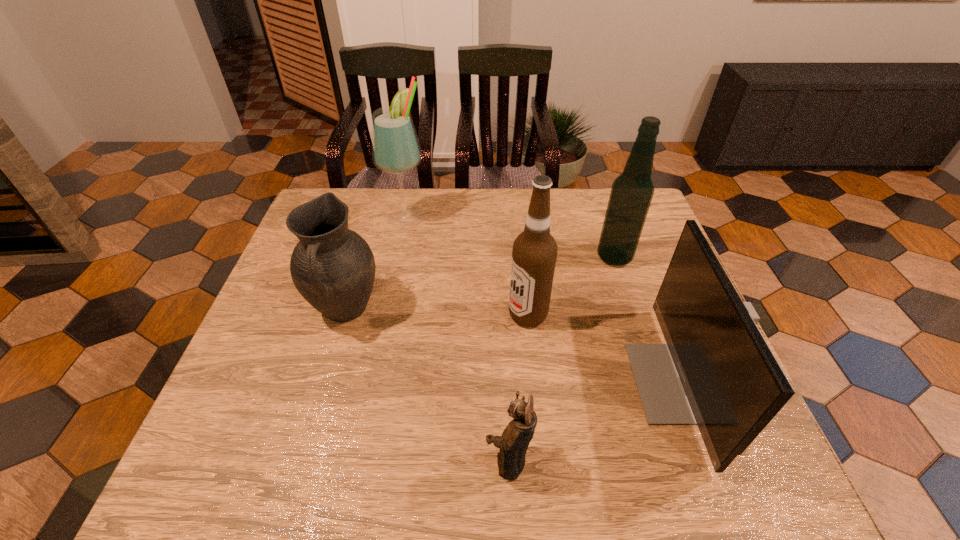
This screenshot has width=960, height=540. I want to click on free space that is in between the computer monitor and the second nearest alcohol, so click(648, 320).

Find the location of `blank region between the nearest alcohol and the computer monitor`. blank region between the nearest alcohol and the computer monitor is located at coordinates (605, 349).

Identify the location of object that is the nearest to the rightmost alcohol. The width and height of the screenshot is (960, 540). (717, 371).

Where is `object that is the fourth nearest to the shortest object`? The width and height of the screenshot is (960, 540). object that is the fourth nearest to the shortest object is located at coordinates (631, 194).

Point out which alcohol is positioned as the nearest to the second farthest alcohol. Please provide its 2D coordinates. Your answer should be formatted as a tuple, i.e. [(x, y)], where the tuple contains the x and y coordinates of a point satisfying the conditions above.

[(534, 254)]

Identify the location of alcohol identified as the third closest to the figurine. (396, 150).

Locate an element on the screen. The image size is (960, 540). vacant region that satisfies the following two spatial constraints: 1. on the front side of the rightmost alcohol; 2. on the front-facing side of the shortest object is located at coordinates (682, 461).